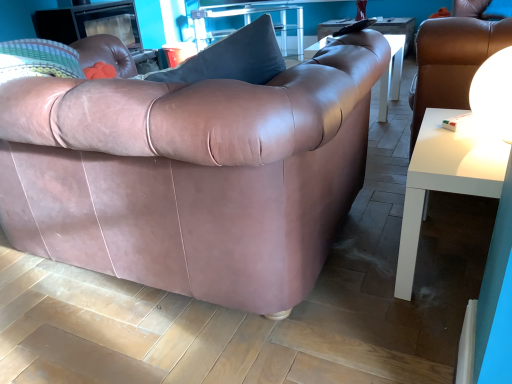
Question: Is white glossy sphere at upper right at the right side of matte leather couch at center?

Choices:
 (A) no
 (B) yes

Answer: (B)

Question: Is white glossy sphere at upper right positioned in front of matte leather couch at center?

Choices:
 (A) yes
 (B) no

Answer: (B)

Question: Is white glossy sphere at upper right outside matte leather couch at center?

Choices:
 (A) yes
 (B) no

Answer: (A)

Question: Is white glossy sphere at upper right facing towards matte leather couch at center?

Choices:
 (A) yes
 (B) no

Answer: (A)

Question: Is matte leather couch at center surrounded by white glossy sphere at upper right?

Choices:
 (A) no
 (B) yes

Answer: (A)

Question: Looking at the image, does white glossy side table at right seem bigger or smaller compared to clear glass table at upper center, the second table ordered from the bottom?

Choices:
 (A) small
 (B) big

Answer: (B)

Question: Considering the positions of white glossy side table at right and clear glass table at upper center, the 1th table from the top, in the image, is white glossy side table at right taller or shorter than clear glass table at upper center, the 1th table from the top,?

Choices:
 (A) short
 (B) tall

Answer: (B)

Question: In terms of width, does white glossy side table at right look wider or thinner when compared to clear glass table at upper center, marked as the second table in a front-to-back arrangement?

Choices:
 (A) wide
 (B) thin

Answer: (A)

Question: Relative to clear glass table at upper center, the 1th table from the top, is white glossy side table at right in front or behind?

Choices:
 (A) front
 (B) behind

Answer: (A)

Question: Visually, is white glossy sphere at upper right positioned to the left or to the right of matte leather couch at center?

Choices:
 (A) right
 (B) left

Answer: (A)

Question: In terms of width, does white glossy sphere at upper right look wider or thinner when compared to matte leather couch at center?

Choices:
 (A) wide
 (B) thin

Answer: (B)

Question: Choose the correct answer: Is white glossy sphere at upper right inside matte leather couch at center or outside it?

Choices:
 (A) inside
 (B) outside

Answer: (B)

Question: Relative to matte leather couch at center, is white glossy sphere at upper right in front or behind?

Choices:
 (A) behind
 (B) front

Answer: (A)

Question: Is matte leather couch at center bigger or smaller than white glossy table at lower right, arranged as the second table when viewed from the top?

Choices:
 (A) big
 (B) small

Answer: (A)

Question: From the image's perspective, relative to white glossy table at lower right, marked as the second table in a back-to-front arrangement, is matte leather couch at center above or below?

Choices:
 (A) below
 (B) above

Answer: (B)